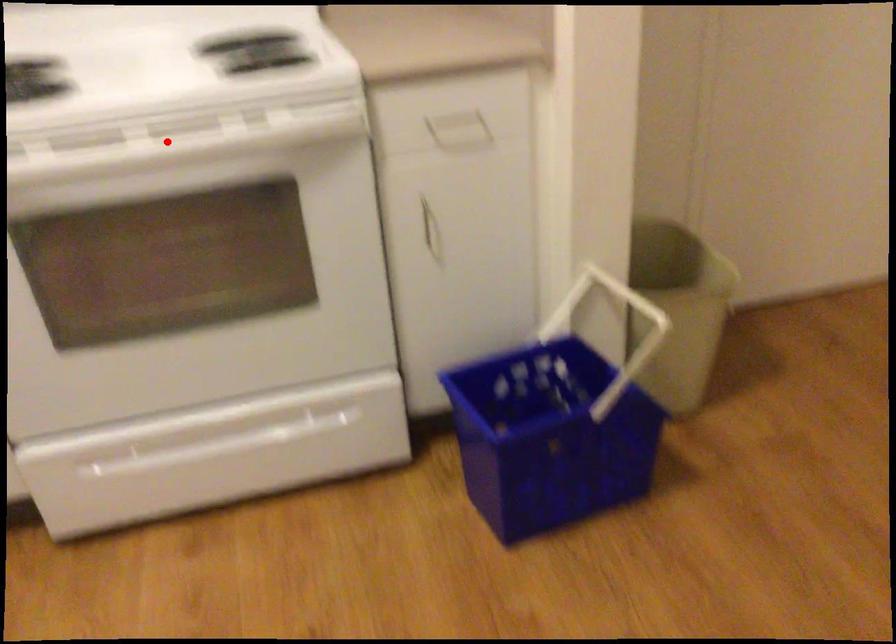
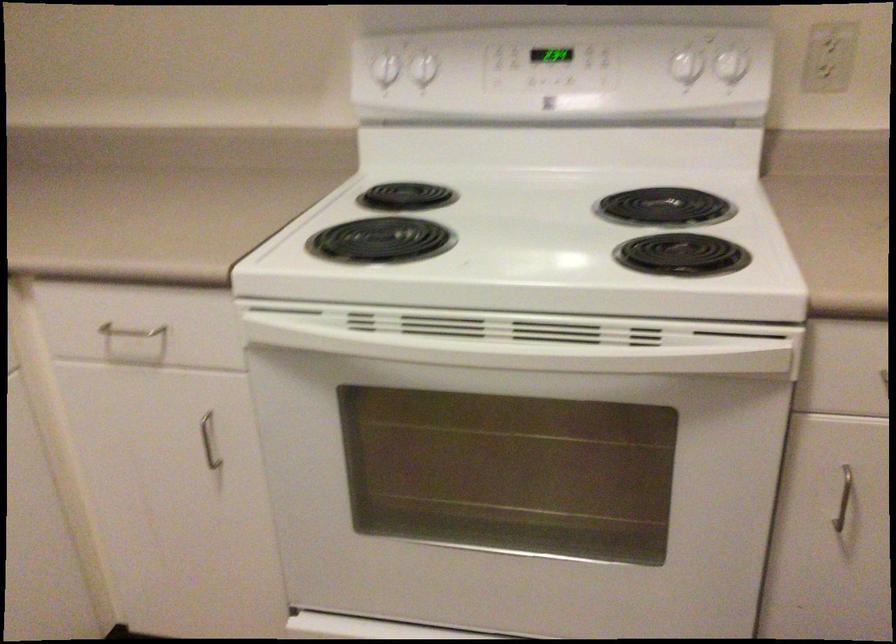
Question: I am providing you with two images of the same scene from different viewpoints. In image1, a red point is highlighted. Considering the same 3D point in image2, which of the following is correct?

Choices:
 (A) It is closer
 (B) It is farther

Answer: (A)